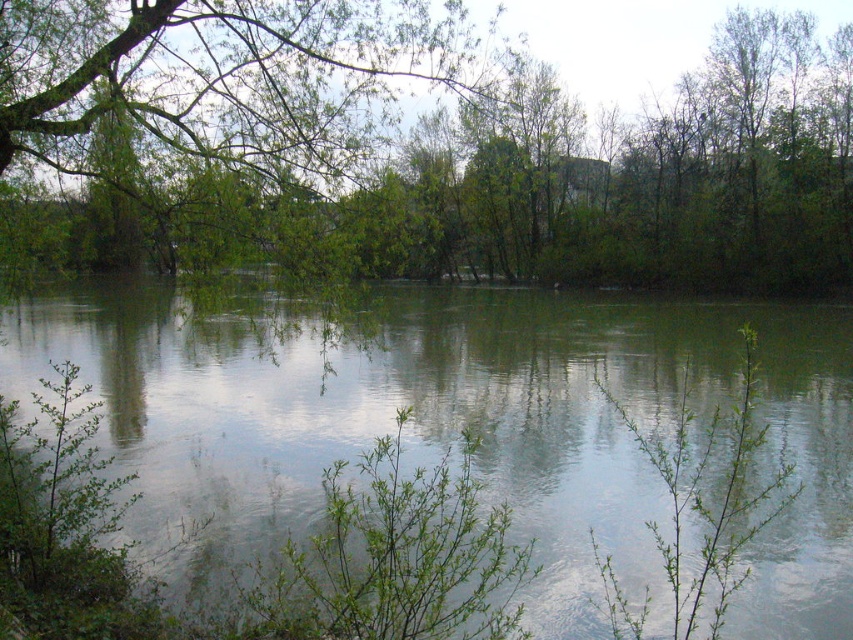
Who is positioned more to the left, green leafy tree at center or green reflective water at center?

green reflective water at center

Can you confirm if green leafy tree at center is bigger than green reflective water at center?

Yes.

Does point (239, 29) come closer to viewer compared to point (49, 307)?

Yes, point (239, 29) is in front of point (49, 307).

The width and height of the screenshot is (853, 640). Identify the location of green leafy tree at center. (415, 148).